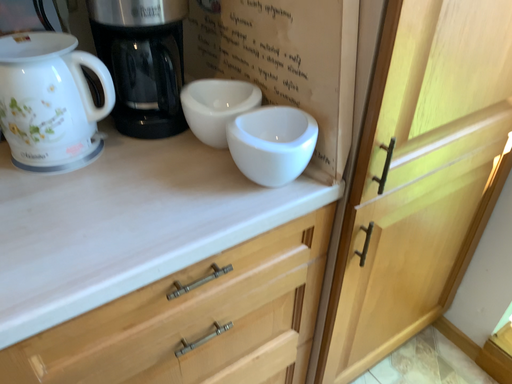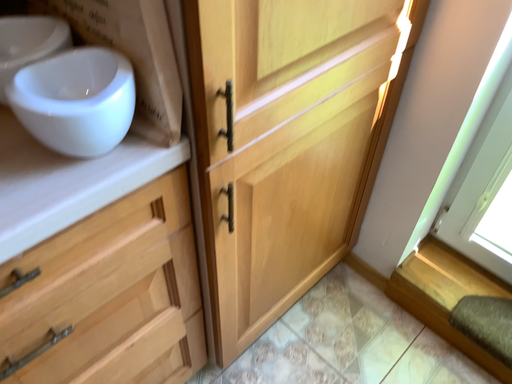
Question: How did the camera likely rotate when shooting the video?

Choices:
 (A) rotated downward
 (B) rotated upward

Answer: (A)